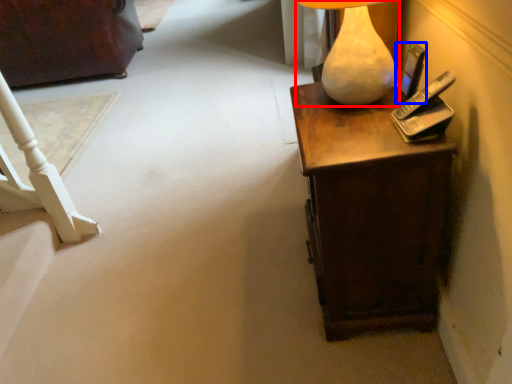
Question: Which of the following is the closest to the observer, lamp (highlighted by a red box) or mobile phone (highlighted by a blue box)?

Choices:
 (A) lamp
 (B) mobile phone

Answer: (A)